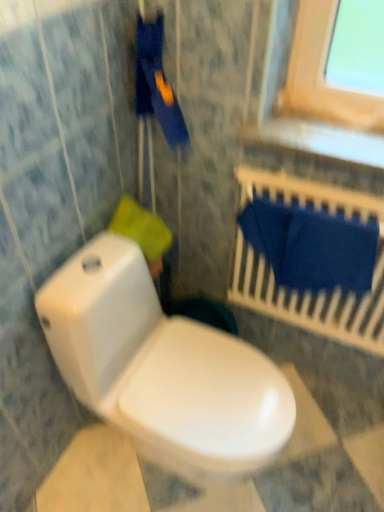
Question: Does white glossy toilet at lower left appear on the right side of blue fabric at upper right?

Choices:
 (A) yes
 (B) no

Answer: (B)

Question: Is white glossy toilet at lower left positioned behind blue fabric at upper right?

Choices:
 (A) yes
 (B) no

Answer: (B)

Question: From the image's perspective, is white glossy toilet at lower left on top of blue fabric at upper right?

Choices:
 (A) yes
 (B) no

Answer: (B)

Question: From a real-world perspective, is white glossy toilet at lower left beneath blue fabric at upper right?

Choices:
 (A) yes
 (B) no

Answer: (A)

Question: Are white glossy toilet at lower left and blue fabric at upper right making contact?

Choices:
 (A) no
 (B) yes

Answer: (A)

Question: From the image's perspective, relative to yellow fabric at upper left, is blue fabric at upper right above or below?

Choices:
 (A) above
 (B) below

Answer: (B)

Question: In terms of height, does blue fabric at upper right look taller or shorter compared to yellow fabric at upper left?

Choices:
 (A) tall
 (B) short

Answer: (A)

Question: Is blue fabric at upper right spatially inside yellow fabric at upper left, or outside of it?

Choices:
 (A) inside
 (B) outside

Answer: (B)

Question: Considering the relative positions of blue fabric at upper right and yellow fabric at upper left in the image provided, is blue fabric at upper right to the left or to the right of yellow fabric at upper left?

Choices:
 (A) right
 (B) left

Answer: (A)

Question: Is point (185, 425) positioned closer to the camera than point (319, 320)?

Choices:
 (A) closer
 (B) farther

Answer: (A)

Question: Based on their positions, is white glossy toilet at lower left located to the left or right of blue fabric at upper right?

Choices:
 (A) right
 (B) left

Answer: (B)

Question: Considering the positions of white glossy toilet at lower left and blue fabric at upper right in the image, is white glossy toilet at lower left wider or thinner than blue fabric at upper right?

Choices:
 (A) thin
 (B) wide

Answer: (B)

Question: In terms of height, does white glossy toilet at lower left look taller or shorter compared to blue fabric at upper right?

Choices:
 (A) short
 (B) tall

Answer: (B)

Question: Considering the relative positions of white glossy toilet at lower left and yellow fabric at upper left in the image provided, is white glossy toilet at lower left to the left or to the right of yellow fabric at upper left?

Choices:
 (A) left
 (B) right

Answer: (B)

Question: In the image, is white glossy toilet at lower left positioned in front of or behind yellow fabric at upper left?

Choices:
 (A) behind
 (B) front

Answer: (B)